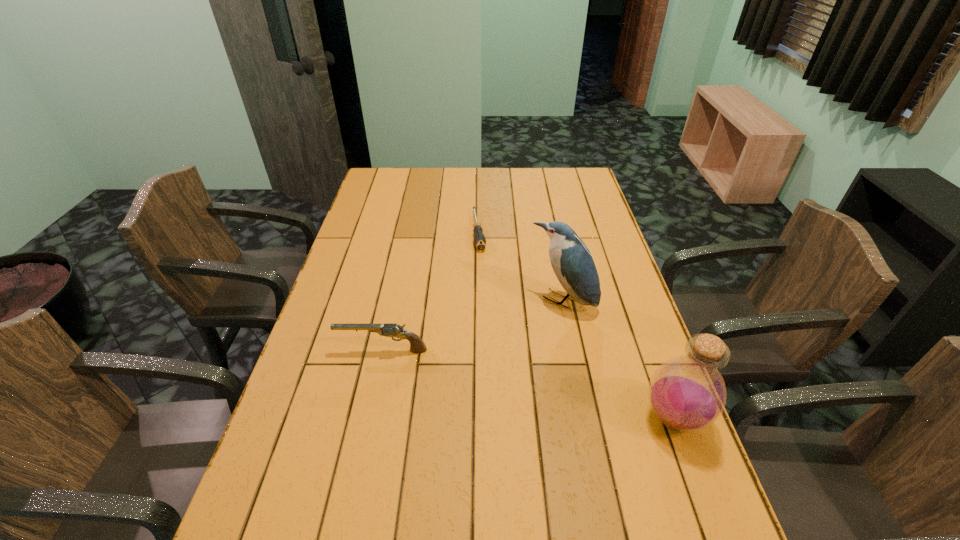
You are a GUI agent. You are given a task and a screenshot of the screen. Output one action in this format:
    pyautogui.click(x=<x>, y=<y>)
    Task: Click on the free space between the third tallest object and the third nearest object
    
    Given the screenshot: What is the action you would take?
    pyautogui.click(x=472, y=326)

Find the location of a particular element. The height and width of the screenshot is (540, 960). vacant space in between the farthest object and the gun is located at coordinates (431, 291).

What are the coordinates of `unoccupied position between the second shortest object and the third nearest object` in the screenshot? It's located at (472, 326).

I want to click on object that is the third closest to the second nearest object, so click(x=687, y=393).

Select which object is the third closest to the second object from right to left. Please provide its 2D coordinates. Your answer should be formatted as a tuple, i.e. [(x, y)], where the tuple contains the x and y coordinates of a point satisfying the conditions above.

[(417, 345)]